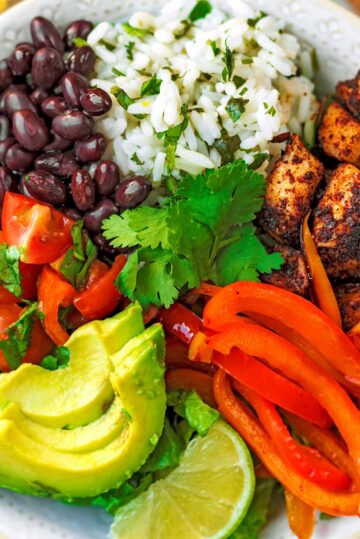
Identify the location of plate. (94, 6).